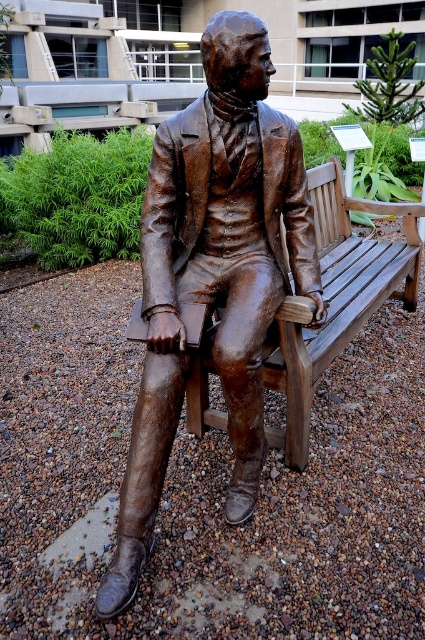
Question: Which of the following is the closest to the observer?

Choices:
 (A) shiny bronze statue at center
 (B) wooden bench at center

Answer: (A)

Question: Is shiny bronze statue at center bigger than wooden bench at center?

Choices:
 (A) yes
 (B) no

Answer: (B)

Question: Among these objects, which one is farthest from the camera?

Choices:
 (A) wooden bench at center
 (B) shiny bronze statue at center

Answer: (A)

Question: Is shiny bronze statue at center above wooden bench at center?

Choices:
 (A) no
 (B) yes

Answer: (A)

Question: Considering the relative positions of shiny bronze statue at center and wooden bench at center in the image provided, where is shiny bronze statue at center located with respect to wooden bench at center?

Choices:
 (A) below
 (B) above

Answer: (A)